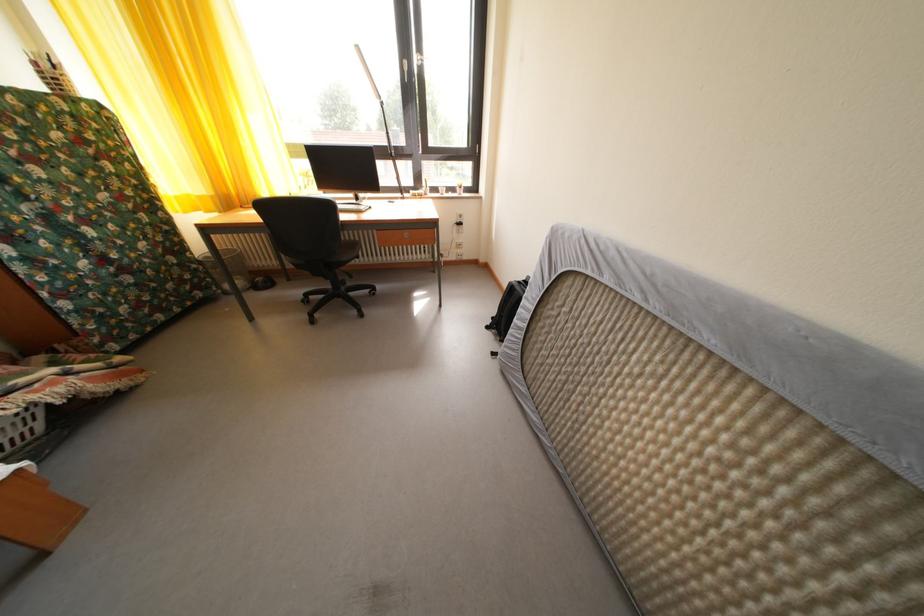
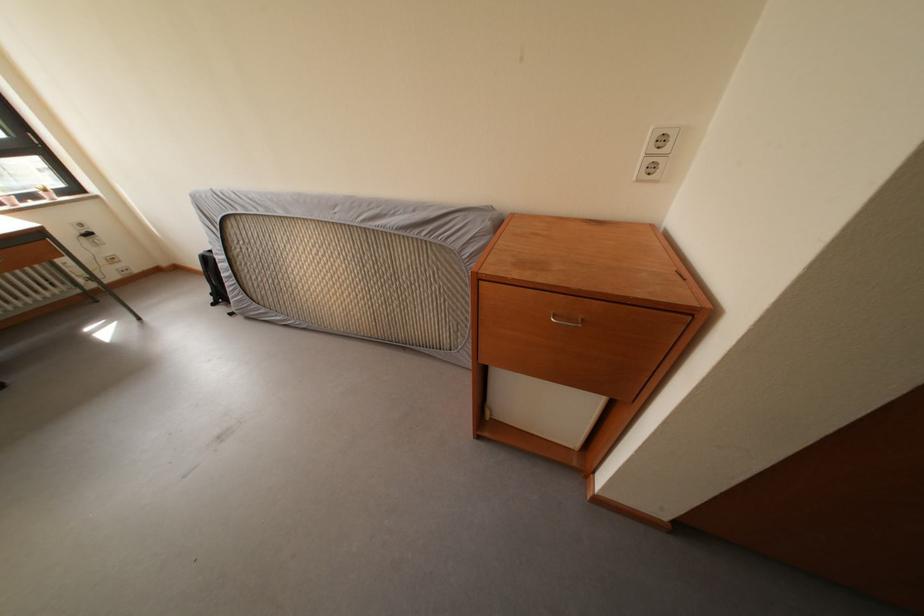
Locate, in the second image, the point that corresponds to (468,257) in the first image.

(128, 273)